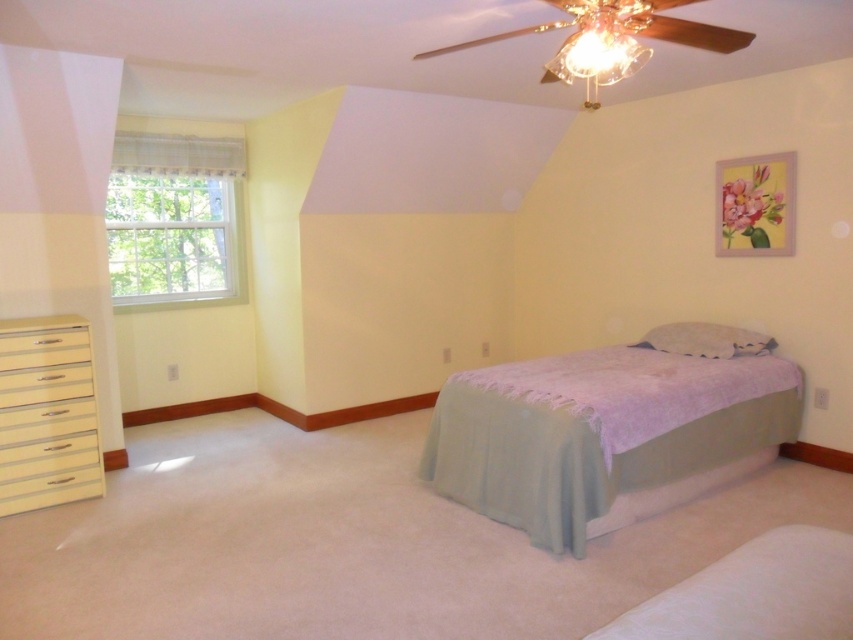
You are a guest staying in this bedroom and want to place a small nightstand between the light blue fabric bed at center and the crystal glass chandelier at upper center. Is this possible?

The light blue fabric bed at center is positioned under the crystal glass chandelier at upper center, so placing a nightstand between them is not feasible as they are vertically aligned rather than horizontally spaced apart.

You are standing in the bedroom and want to hang a new painting. The painting requires a hook that can be placed above the white fabric pillow at center. Can the crystal glass chandelier at upper center interfere with hanging the painting?

The crystal glass chandelier at upper center is taller than the white fabric pillow at center, so it may interfere with hanging the painting above the pillow.